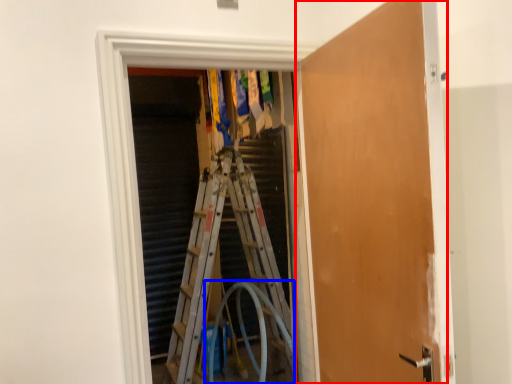
Question: Which point is further to the camera, door (highlighted by a red box) or garden hose (highlighted by a blue box)?

Choices:
 (A) door
 (B) garden hose

Answer: (B)